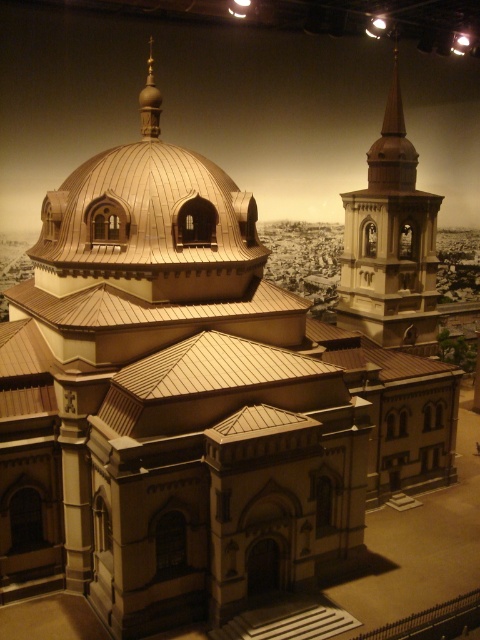
You are an architect examining the model of the grand building. You notice the gold textured spire at upper right and the gold polished dome at upper center. Which of these two elements has a greater width?

The gold textured spire at upper right has a greater width than the gold polished dome at upper center.

You are an architect examining the architectural model of the building. You need to determine which object is bigger between the gold textured spire at upper right and the gold polished dome at upper center. Based on the model, which one is larger?

The gold textured spire at upper right is larger in size than the gold polished dome at upper center.

You are examining the architectural model of the grand building. There are two points marked on the model at coordinates point (411,198) and point (156,134). Which of these points is closer to your viewpoint?

Point (411,198) is further to the camera than point (156,134), so the point closer to your viewpoint is point (156,134).